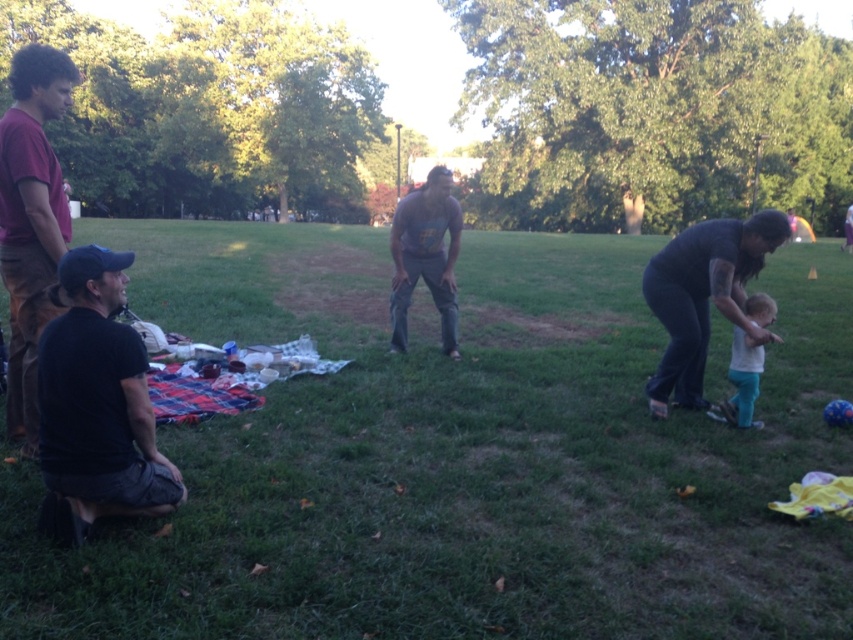
Question: Which object is the farthest from the dark gray pants at right?

Choices:
 (A) dark gray t-shirt at center
 (B) black cotton shirt at lower left
 (C) maroon cotton shirt at left

Answer: (C)

Question: Among these points, which one is farthest from the camera?

Choices:
 (A) (9, 298)
 (B) (759, 266)

Answer: (B)

Question: Which object is farther from the camera taking this photo?

Choices:
 (A) white cotton shirt at right
 (B) dark gray pants at right
 (C) green grass at center

Answer: (A)

Question: Is green grass at center to the left of dark gray t-shirt at center from the viewer's perspective?

Choices:
 (A) no
 (B) yes

Answer: (A)

Question: Can you confirm if green grass at center is wider than white cotton shirt at right?

Choices:
 (A) no
 (B) yes

Answer: (B)

Question: Does black cotton shirt at lower left lie in front of dark gray t-shirt at center?

Choices:
 (A) no
 (B) yes

Answer: (B)